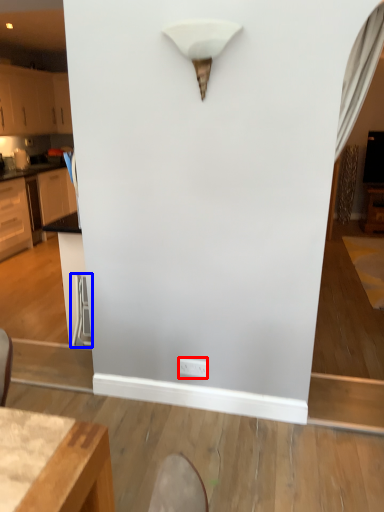
Question: Which point is closer to the camera, electric outlet (highlighted by a red box) or swivel chair (highlighted by a blue box)?

Choices:
 (A) electric outlet
 (B) swivel chair

Answer: (A)